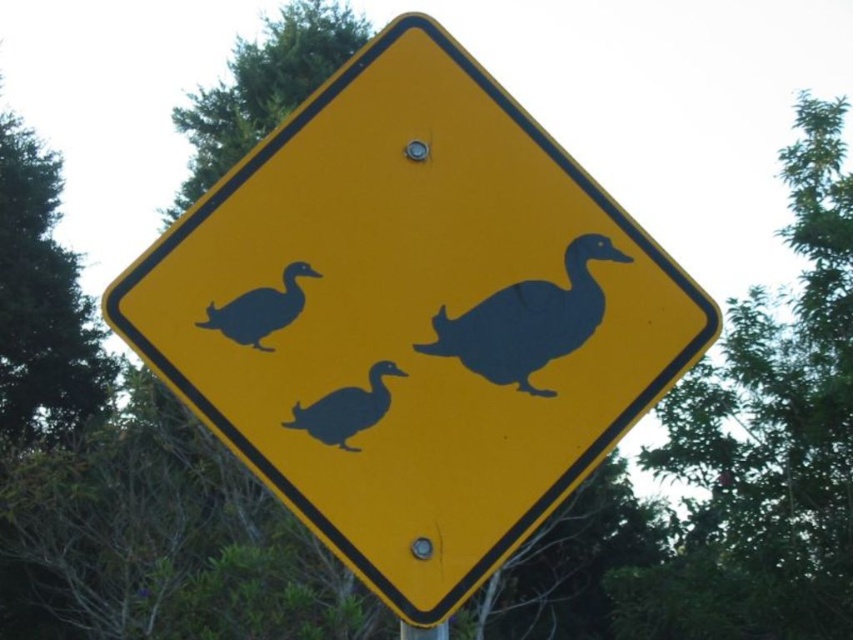
You are a delivery drone with a camera that has a 10 inch wide field of view. You are flying above the road sign and want to capture both the black matte duck at center and the metallic silver pole at lower center in the same photo. Can you fit both objects within your camera view?

The black matte duck at center and metallic silver pole at lower center are 8.34 inches apart. Since your camera has a 10 inch wide field of view, which is wider than the distance between them, you can fit both objects within your camera view.

You are standing in front of the yellow road sign with ducks. There are two points marked on the sign at coordinates point [183,243] and point [437,632]. Which point is closer to you?

Point [183,243] is closer to you because it is further to the viewer than point [437,632].